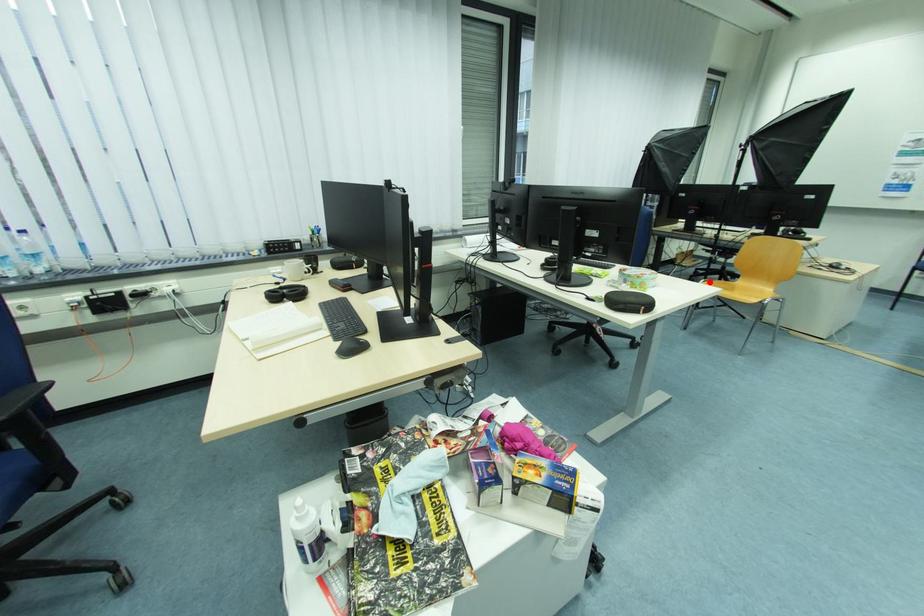
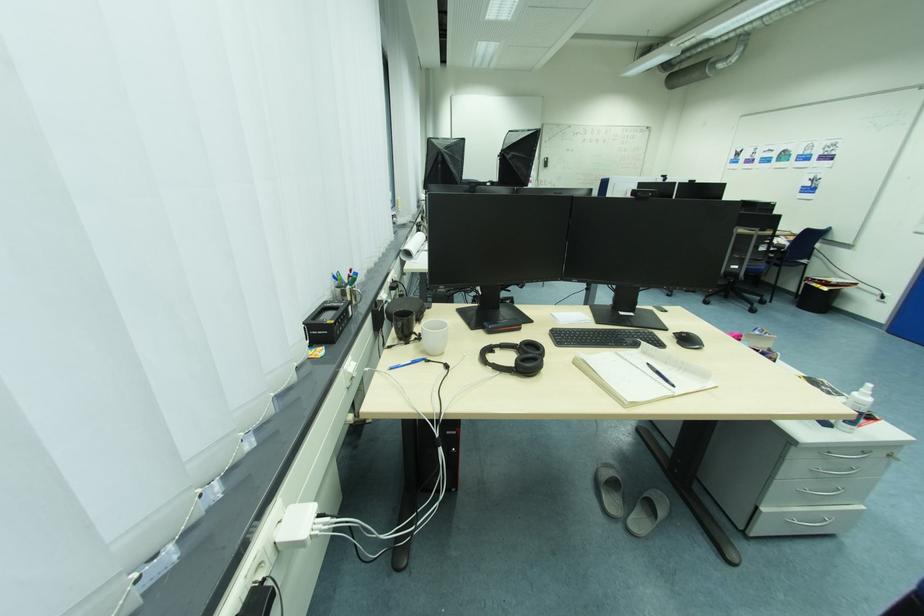
Question: I am providing you with two images of the same scene from different viewpoints. A red point is marked on the first image. At the location where the point appears in image 1, is it still visible in image 2?

Choices:
 (A) Yes
 (B) No

Answer: (B)